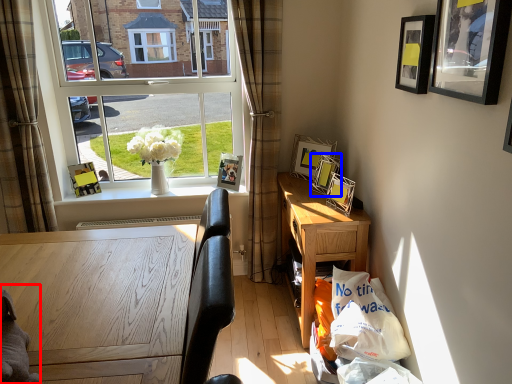
Question: Which object appears farthest to the camera in this image, animal (highlighted by a red box) or picture frame (highlighted by a blue box)?

Choices:
 (A) animal
 (B) picture frame

Answer: (B)